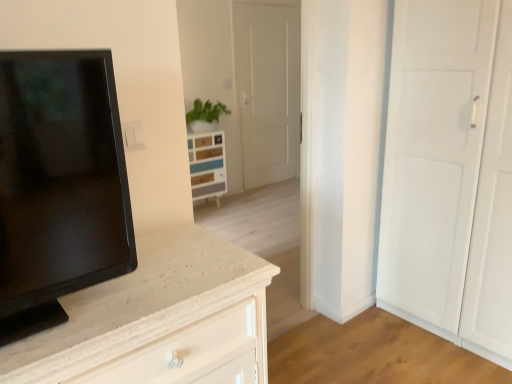
What is the approximate width of black glossy tv at left?

6.16 inches.

Image resolution: width=512 pixels, height=384 pixels. I want to click on black glossy tv at left, so click(59, 185).

What do you see at coordinates (59, 185) in the screenshot? The image size is (512, 384). I see `black glossy tv at left` at bounding box center [59, 185].

In the scene shown: Measure the distance between black glossy tv at left and camera.

They are 84.99 centimeters apart.

What is the approximate height of black glossy tv at left?

black glossy tv at left is 23.91 inches tall.

What do you see at coordinates (207, 165) in the screenshot? This screenshot has height=384, width=512. I see `wooden chest of drawers at center` at bounding box center [207, 165].

Measure the distance between point (210,160) and camera.

Point (210,160) is 13.65 feet from camera.

This screenshot has height=384, width=512. Identify the location of wooden chest of drawers at center. (207, 165).

Find the location of `black glossy tv at left`. black glossy tv at left is located at coordinates 59,185.

Does wooden chest of drawers at center appear on the right side of black glossy tv at left?

In fact, wooden chest of drawers at center is to the left of black glossy tv at left.

Who is more distant, wooden chest of drawers at center or black glossy tv at left?

wooden chest of drawers at center is further away from the camera.

Does point (199, 146) come behind point (123, 260)?

Yes, it is.

From the image's perspective, is wooden chest of drawers at center beneath black glossy tv at left?

No.

From a real-world perspective, which object rests below the other?

wooden chest of drawers at center.

Considering the sizes of wooden chest of drawers at center and black glossy tv at left in the image, is wooden chest of drawers at center wider or thinner than black glossy tv at left?

wooden chest of drawers at center is wider than black glossy tv at left.

Considering the relative sizes of wooden chest of drawers at center and black glossy tv at left in the image provided, is wooden chest of drawers at center shorter than black glossy tv at left?

In fact, wooden chest of drawers at center may be taller than black glossy tv at left.

Who is smaller, wooden chest of drawers at center or black glossy tv at left?

black glossy tv at left.

Would you say wooden chest of drawers at center is inside or outside black glossy tv at left?

wooden chest of drawers at center is located beyond the bounds of black glossy tv at left.

Would you consider wooden chest of drawers at center to be distant from black glossy tv at left?

Yes, wooden chest of drawers at center is far from black glossy tv at left.

Is wooden chest of drawers at center facing away from black glossy tv at left?

wooden chest of drawers at center is not turned away from black glossy tv at left.

Can you tell me how much wooden chest of drawers at center and black glossy tv at left differ in facing direction?

wooden chest of drawers at center and black glossy tv at left are facing 2.33 degrees away from each other.

You are a GUI agent. You are given a task and a screenshot of the screen. Output one action in this format:
    pyautogui.click(x=<x>, y=<y>)
    Task: Click on the screen above the wooden chest of drawers at center (from a real-world perspective)
    
    Given the screenshot: What is the action you would take?
    pyautogui.click(x=59, y=185)

Based on the photo, which is more to the right, black glossy tv at left or wooden chest of drawers at center?

From the viewer's perspective, black glossy tv at left appears more on the right side.

Does black glossy tv at left come behind wooden chest of drawers at center?

No, black glossy tv at left is closer to the camera.

Is point (106, 105) positioned behind point (218, 158)?

No, it is not.

From the image's perspective, is black glossy tv at left below wooden chest of drawers at center?

Indeed, from the image's perspective, black glossy tv at left is shown beneath wooden chest of drawers at center.

From a real-world perspective, which object stands above the other?

black glossy tv at left.

Between black glossy tv at left and wooden chest of drawers at center, which one has larger width?

wooden chest of drawers at center is wider.

Considering the sizes of objects black glossy tv at left and wooden chest of drawers at center in the image provided, who is taller, black glossy tv at left or wooden chest of drawers at center?

wooden chest of drawers at center.

Is black glossy tv at left bigger than wooden chest of drawers at center?

No, black glossy tv at left is not bigger than wooden chest of drawers at center.

Is black glossy tv at left spatially inside wooden chest of drawers at center, or outside of it?

black glossy tv at left is spatially situated outside wooden chest of drawers at center.

Is black glossy tv at left beside wooden chest of drawers at center?

They are not placed beside each other.

Is black glossy tv at left looking in the opposite direction of wooden chest of drawers at center?

No, wooden chest of drawers at center is not at the back of black glossy tv at left.

Can you tell me how much black glossy tv at left and wooden chest of drawers at center differ in facing direction?

2.33 degrees.

Locate an element on the screen. the chest of drawers that is behind the black glossy tv at left is located at coordinates (207, 165).

At what (x,y) coordinates should I click in order to perform the action: click on screen above the wooden chest of drawers at center (from a real-world perspective). Please return your answer as a coordinate pair (x, y). Looking at the image, I should click on (59, 185).

The height and width of the screenshot is (384, 512). I want to click on screen in front of the wooden chest of drawers at center, so click(x=59, y=185).